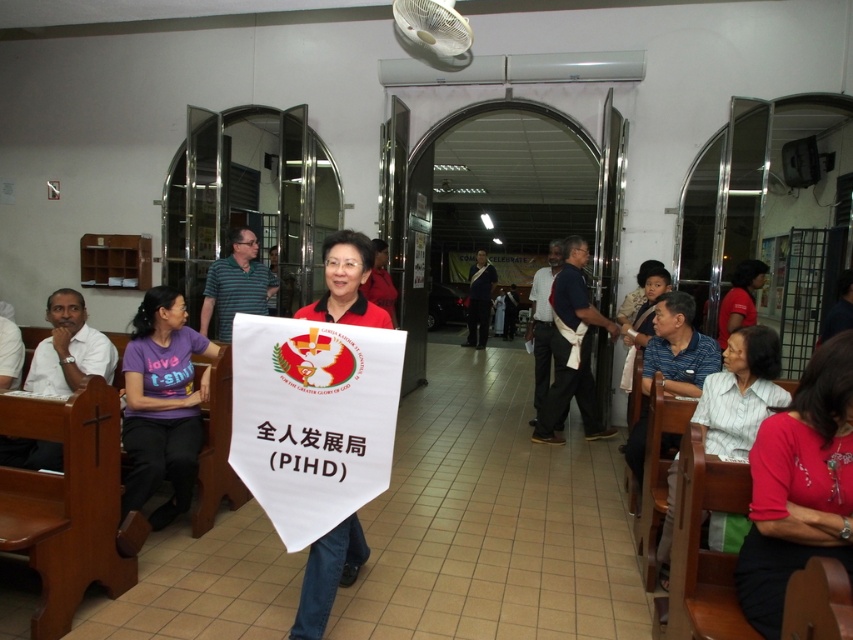
Does point (155, 372) come in front of point (746, 264)?

Yes, it is.

Locate an element on the screen. The image size is (853, 640). purple t-shirt at left is located at coordinates (161, 404).

Does purple t-shirt at left come behind white striped shirt at lower right?

Yes, it is.

The image size is (853, 640). I want to click on purple t-shirt at left, so [161, 404].

In the scene shown: Who is more distant from viewer, (793, 428) or (323, 566)?

The point (323, 566) is behind.

Is matte red blouse at lower right to the left of red matte banner at center from the viewer's perspective?

No, matte red blouse at lower right is not to the left of red matte banner at center.

This screenshot has height=640, width=853. Describe the element at coordinates (799, 486) in the screenshot. I see `matte red blouse at lower right` at that location.

The image size is (853, 640). What are the coordinates of `matte red blouse at lower right` in the screenshot? It's located at (799, 486).